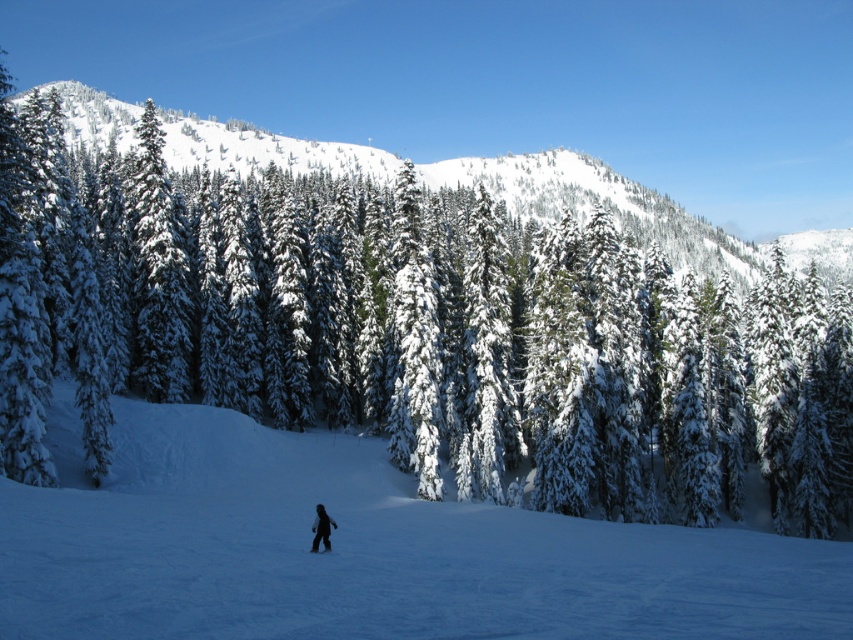
Is snow-covered evergreen at center thinner than snowy pine forest at upper left?

Correct, snow-covered evergreen at center's width is less than snowy pine forest at upper left's.

This screenshot has height=640, width=853. In order to click on snow-covered evergreen at center in this screenshot , I will do (x=422, y=324).

Find the location of a particular element. snow-covered evergreen at center is located at coordinates (422, 324).

Can you confirm if dark woolen jacket at center is shorter than black matte ski at lower center?

No.

Which of these two, dark woolen jacket at center or black matte ski at lower center, stands taller?

dark woolen jacket at center

Find the location of a particular element. The height and width of the screenshot is (640, 853). dark woolen jacket at center is located at coordinates (321, 529).

Between white snow at center and snowy pine forest at upper left, which one has less height?

Standing shorter between the two is white snow at center.

Does point (628, 544) come behind point (195, 125)?

No, (628, 544) is closer to viewer.

This screenshot has height=640, width=853. Find the location of `white snow at center`. white snow at center is located at coordinates (363, 550).